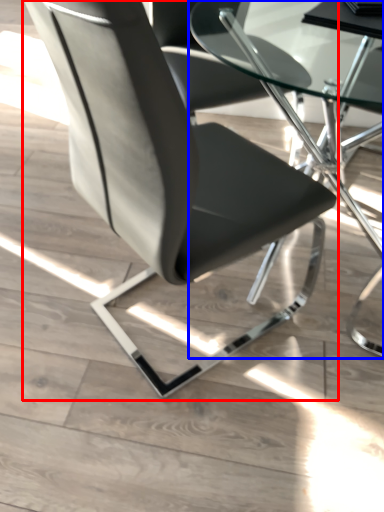
Question: Which object appears farthest to the camera in this image, chair (highlighted by a red box) or table (highlighted by a blue box)?

Choices:
 (A) chair
 (B) table

Answer: (B)